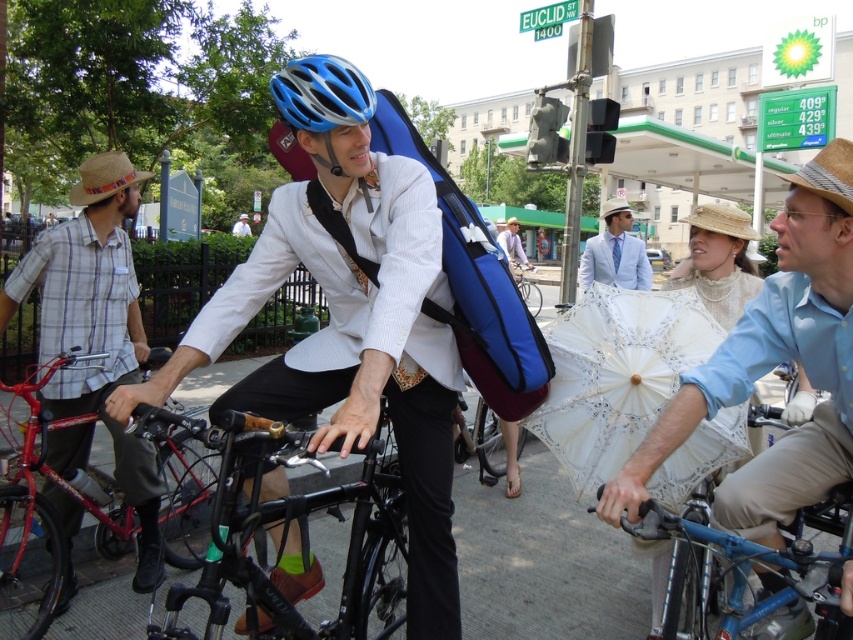
Who is more distant from viewer, [763,307] or [241,218]?

Point [241,218]

What do you see at coordinates (763, 374) in the screenshot?
I see `light blue cotton shirt at center` at bounding box center [763, 374].

Does point (811, 323) come closer to viewer compared to point (244, 234)?

Yes, point (811, 323) is in front of point (244, 234).

In order to click on light blue cotton shirt at center in this screenshot , I will do `click(763, 374)`.

Does brown straw hat at left appear on the right side of matte blue backpack at center?

In fact, brown straw hat at left is to the left of matte blue backpack at center.

Which is below, brown straw hat at left or matte blue backpack at center?

brown straw hat at left is lower down.

Who is more forward, (106, 184) or (509, 262)?

Positioned in front is point (106, 184).

Find the location of a particular element. The image size is (853, 640). brown straw hat at left is located at coordinates click(103, 177).

Is matte blue helmet at center positioned before blue matte bicycle helmet at center?

Yes, it is.

Who is shorter, matte blue helmet at center or blue matte bicycle helmet at center?

With less height is blue matte bicycle helmet at center.

Between point (216, 317) and point (345, 90), which one is positioned in front?

Point (345, 90)

I want to click on matte blue helmet at center, so click(349, 317).